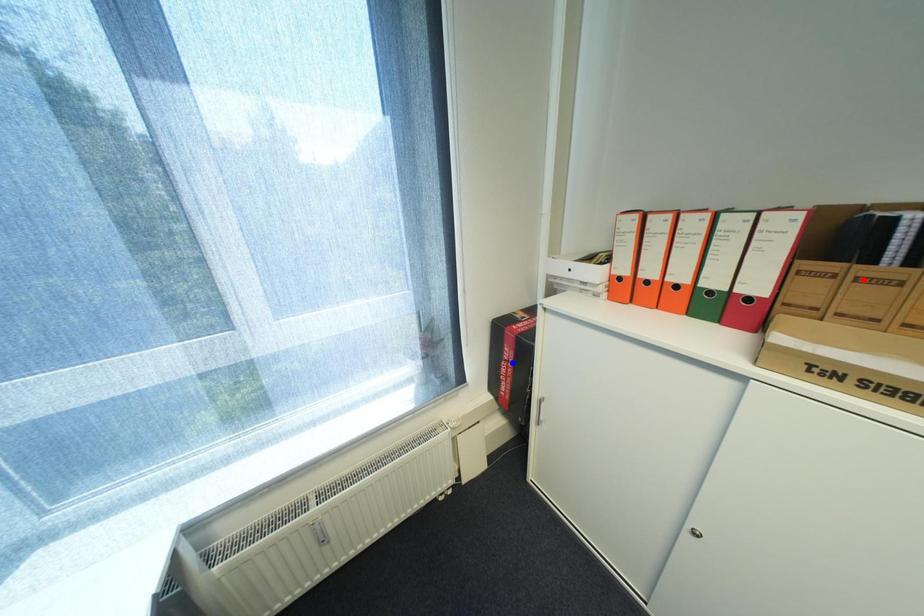
Question: Two points are marked on the image. Which point is closer to the camera?

Choices:
 (A) Blue point is closer.
 (B) Red point is closer.

Answer: (B)